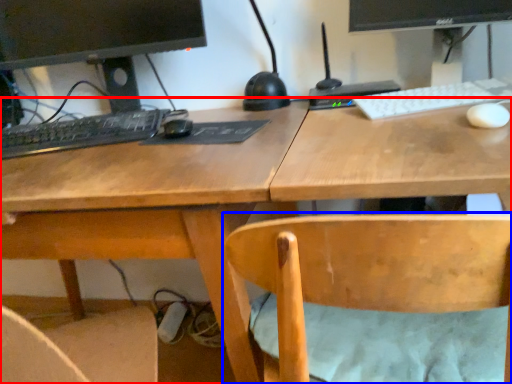
Question: Which object is further to the camera taking this photo, desk (highlighted by a red box) or chair (highlighted by a blue box)?

Choices:
 (A) desk
 (B) chair

Answer: (A)